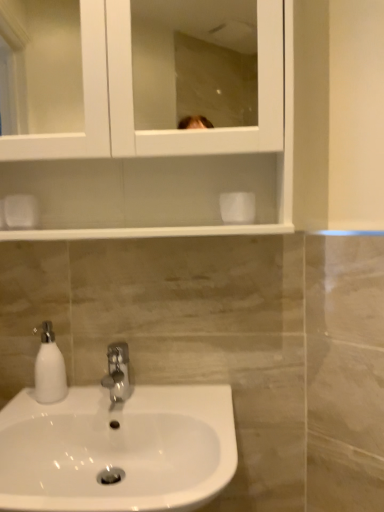
You are a GUI agent. You are given a task and a screenshot of the screen. Output one action in this format:
    pyautogui.click(x=<x>, y=<y>)
    Task: Click on the vacant space positioned to the left of polished chrome faucet at center
    This screenshot has height=512, width=384.
    Given the screenshot: What is the action you would take?
    pyautogui.click(x=59, y=403)